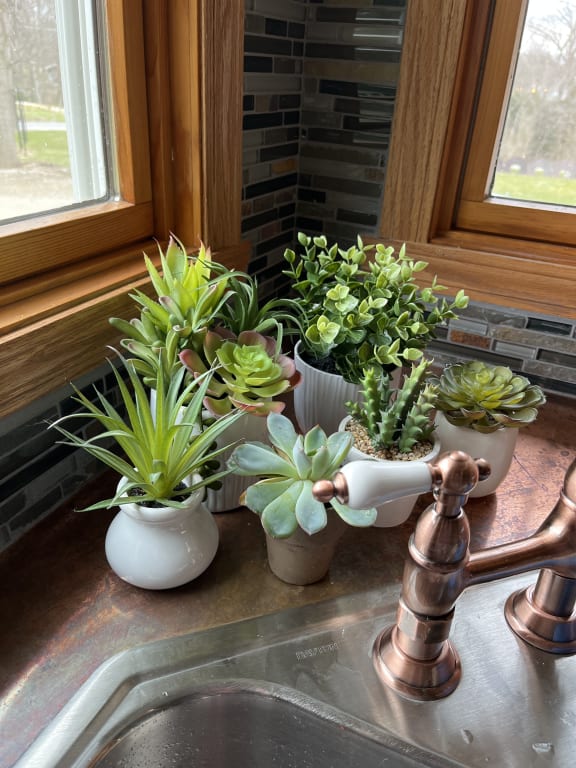
Find the location of `rounded plant pot base in white`. rounded plant pot base in white is located at coordinates (151, 560).